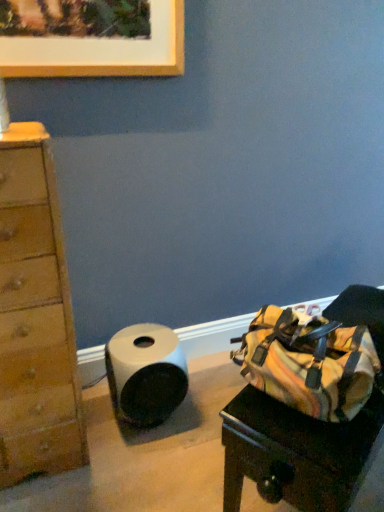
Locate an element on the screen. The height and width of the screenshot is (512, 384). white matte paper towel at lower left is located at coordinates (145, 374).

The height and width of the screenshot is (512, 384). Describe the element at coordinates (145, 374) in the screenshot. I see `white matte paper towel at lower left` at that location.

What is the approximate height of white matte paper towel at lower left?

The height of white matte paper towel at lower left is 34.01 centimeters.

Image resolution: width=384 pixels, height=512 pixels. I want to click on striped canvas duffel bag at right, so click(x=294, y=453).

Describe the element at coordinates (294, 453) in the screenshot. The image size is (384, 512). I see `striped canvas duffel bag at right` at that location.

What is the approximate height of striped canvas duffel bag at right?

It is 19.22 inches.

I want to click on white matte paper towel at lower left, so click(x=145, y=374).

Based on the photo, which is more to the left, striped canvas duffel bag at right or white matte paper towel at lower left?

white matte paper towel at lower left is more to the left.

Looking at this image, is striped canvas duffel bag at right in front of or behind white matte paper towel at lower left in the image?

Visually, striped canvas duffel bag at right is located in front of white matte paper towel at lower left.

Considering the positions of points (270, 474) and (142, 397), is point (270, 474) farther from camera compared to point (142, 397)?

No, (270, 474) is in front of (142, 397).

From the image's perspective, does striped canvas duffel bag at right appear lower than white matte paper towel at lower left?

Correct, striped canvas duffel bag at right appears lower than white matte paper towel at lower left in the image.

From a real-world perspective, between striped canvas duffel bag at right and white matte paper towel at lower left, who is vertically lower?

In real-world perspective, white matte paper towel at lower left is lower.

Which of these two, striped canvas duffel bag at right or white matte paper towel at lower left, is wider?

striped canvas duffel bag at right.

From the picture: Does striped canvas duffel bag at right have a greater height compared to white matte paper towel at lower left?

Correct, striped canvas duffel bag at right is much taller as white matte paper towel at lower left.

Who is smaller, striped canvas duffel bag at right or white matte paper towel at lower left?

Smaller between the two is white matte paper towel at lower left.

Would you say striped canvas duffel bag at right is outside white matte paper towel at lower left?

Indeed, striped canvas duffel bag at right is completely outside white matte paper towel at lower left.

Is there a large distance between striped canvas duffel bag at right and white matte paper towel at lower left?

No, striped canvas duffel bag at right is not far away from white matte paper towel at lower left.

Based on the photo, could you tell me if striped canvas duffel bag at right is turned towards white matte paper towel at lower left?

No, striped canvas duffel bag at right is not facing towards white matte paper towel at lower left.

I want to click on furniture below the white matte paper towel at lower left (from the image's perspective), so click(294, 453).

Which is more to the left, white matte paper towel at lower left or striped canvas duffel bag at right?

white matte paper towel at lower left is more to the left.

Considering the relative positions of white matte paper towel at lower left and striped canvas duffel bag at right in the image provided, is white matte paper towel at lower left in front of striped canvas duffel bag at right?

No, the depth of white matte paper towel at lower left is greater than that of striped canvas duffel bag at right.

Considering the positions of points (185, 378) and (315, 449), is point (185, 378) closer to camera compared to point (315, 449)?

No, (185, 378) is further to viewer.

From the image's perspective, which one is positioned higher, white matte paper towel at lower left or striped canvas duffel bag at right?

From the image's view, white matte paper towel at lower left is above.

From a real-world perspective, is white matte paper towel at lower left under striped canvas duffel bag at right?

Indeed, from a real-world perspective, white matte paper towel at lower left is positioned beneath striped canvas duffel bag at right.

Does white matte paper towel at lower left have a greater width compared to striped canvas duffel bag at right?

No.

Considering the sizes of white matte paper towel at lower left and striped canvas duffel bag at right in the image, is white matte paper towel at lower left taller or shorter than striped canvas duffel bag at right?

In the image, white matte paper towel at lower left appears to be shorter than striped canvas duffel bag at right.

Between white matte paper towel at lower left and striped canvas duffel bag at right, which one has smaller size?

white matte paper towel at lower left.

Is striped canvas duffel bag at right located within white matte paper towel at lower left?

Definitely not — striped canvas duffel bag at right is not inside white matte paper towel at lower left.

Is white matte paper towel at lower left positioned far away from striped canvas duffel bag at right?

No, white matte paper towel at lower left is in close proximity to striped canvas duffel bag at right.

Could you tell me if white matte paper towel at lower left is facing striped canvas duffel bag at right?

No, white matte paper towel at lower left is not facing towards striped canvas duffel bag at right.

How many degrees apart are the facing directions of white matte paper towel at lower left and striped canvas duffel bag at right?

The angular difference between white matte paper towel at lower left and striped canvas duffel bag at right is 27.9 degrees.

You are a GUI agent. You are given a task and a screenshot of the screen. Output one action in this format:
    pyautogui.click(x=<x>, y=<y>)
    Task: Click on the furniture located below the white matte paper towel at lower left (from the image's perspective)
    
    Given the screenshot: What is the action you would take?
    pyautogui.click(x=294, y=453)

What are the coordinates of `paper towel that is under the striped canvas duffel bag at right (from a real-world perspective)` in the screenshot? It's located at (145, 374).

Where is `furniture above the white matte paper towel at lower left (from a real-world perspective)`? The image size is (384, 512). furniture above the white matte paper towel at lower left (from a real-world perspective) is located at coordinates (294, 453).